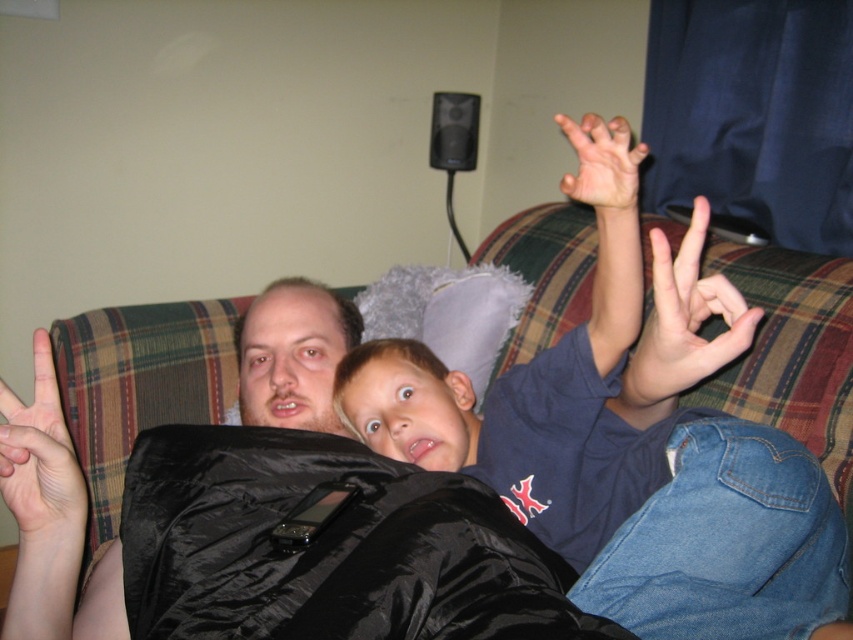
Question: Which object appears farthest from the camera in this image?

Choices:
 (A) smooth skin hand at upper right
 (B) white matte hand at upper right

Answer: (A)

Question: Is white matte hand at upper right smaller than smooth skin hand at upper right?

Choices:
 (A) no
 (B) yes

Answer: (A)

Question: Which point is farther to the camera?

Choices:
 (A) (343, 314)
 (B) (566, 129)
 (C) (366, 486)

Answer: (A)

Question: Which of the following is the closest to the observer?

Choices:
 (A) (659, 312)
 (B) (280, 284)
 (C) (602, 131)
 (D) (424, 461)

Answer: (A)

Question: Is the position of smooth skin face at center more distant than that of pale skin flesh at left?

Choices:
 (A) no
 (B) yes

Answer: (B)

Question: Can you confirm if black silky sleeping bag at center is smaller than smooth skin face at center?

Choices:
 (A) no
 (B) yes

Answer: (A)